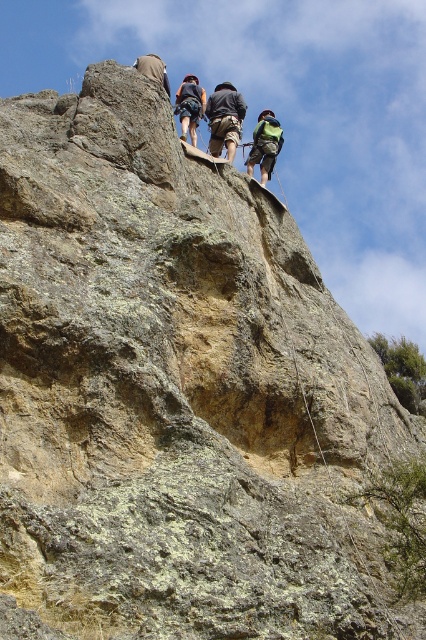
Question: Is green fabric backpack at upper right thinner than dark blue jeans at upper center?

Choices:
 (A) no
 (B) yes

Answer: (A)

Question: Does camouflage pants at center appear on the right side of dark blue jeans at upper center?

Choices:
 (A) yes
 (B) no

Answer: (A)

Question: Which point is farther to the camera?

Choices:
 (A) camouflage pants at center
 (B) dark blue jeans at upper center

Answer: (A)

Question: Among these points, which one is farthest from the camera?

Choices:
 (A) pyautogui.click(x=215, y=116)
 (B) pyautogui.click(x=264, y=118)

Answer: (B)

Question: Does camouflage pants at center have a larger size compared to dark blue jeans at upper center?

Choices:
 (A) no
 (B) yes

Answer: (A)

Question: Estimate the real-world distances between objects in this image. Which object is closer to the green fabric backpack at upper right?

Choices:
 (A) camouflage pants at center
 (B) dark blue jeans at upper center

Answer: (A)